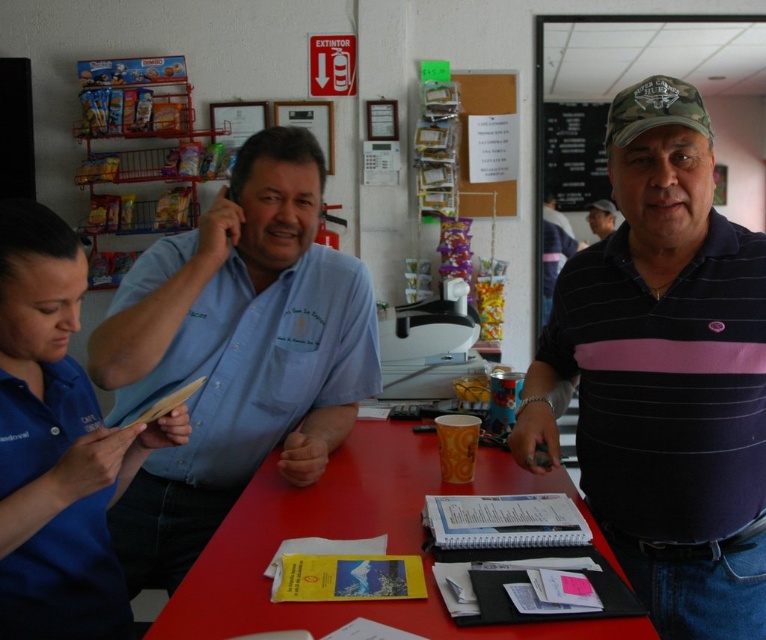
Which is behind, point (565, 177) or point (594, 211)?

Positioned behind is point (594, 211).

Between black matte board at upper center and matte black shirt at center, which one is positioned lower?

matte black shirt at center is lower down.

Between point (581, 192) and point (591, 208), which one is positioned behind?

The point (581, 192) is more distant.

Find the location of `black matte board at upper center`. black matte board at upper center is located at coordinates (574, 154).

What do you see at coordinates (234, 353) in the screenshot? I see `light blue shirt at left` at bounding box center [234, 353].

Which is behind, point (159, 371) or point (609, 224)?

Point (609, 224)

Is point (287, 248) positioned in front of point (591, 216)?

That is True.

Identify the location of light blue shirt at left. (234, 353).

Between blue fabric shirt at upper left and red plastic table at center, which one appears on the right side from the viewer's perspective?

red plastic table at center

Who is more forward, (48, 244) or (368, 481)?

Point (48, 244)

Is point (8, 481) more distant than point (436, 452)?

No, (8, 481) is closer to viewer.

At what (x,y) coordinates should I click in order to perform the action: click on blue fabric shirt at upper left. Please return your answer as a coordinate pair (x, y). Looking at the image, I should click on (57, 444).